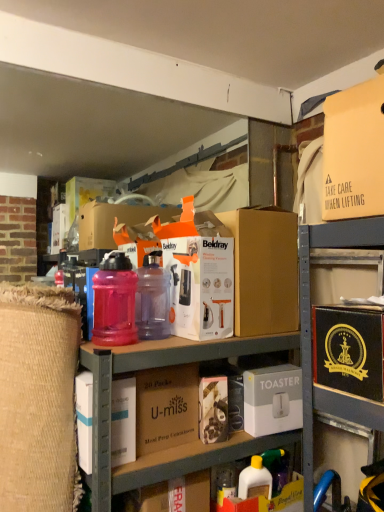
Question: From a real-world perspective, is purple translucent bottle at center, which ranks as the 1th bottle in right-to-left order, beneath white cardboard toaster at center, the 6th box from the top?

Choices:
 (A) yes
 (B) no

Answer: (B)

Question: Is purple translucent bottle at center, which ranks as the 1th bottle in right-to-left order, shorter than white cardboard toaster at center, the 6th box from the top?

Choices:
 (A) no
 (B) yes

Answer: (A)

Question: Is purple translucent bottle at center, which ranks as the 1th bottle in right-to-left order, wider than white cardboard toaster at center, positioned as the 1th box in bottom-to-top order?

Choices:
 (A) no
 (B) yes

Answer: (A)

Question: Is purple translucent bottle at center, which ranks as the 1th bottle in right-to-left order, taller than white cardboard toaster at center, the 6th box from the top?

Choices:
 (A) yes
 (B) no

Answer: (A)

Question: From the image's perspective, does purple translucent bottle at center, which is the second bottle in left-to-right order, appear higher than white cardboard toaster at center, positioned as the 1th box in bottom-to-top order?

Choices:
 (A) yes
 (B) no

Answer: (A)

Question: Is yellow plastic bottle at lower center in front of or behind matte cardboard box at upper right, which is counted as the first box, starting from the top, in the image?

Choices:
 (A) behind
 (B) front

Answer: (A)

Question: Which is correct: yellow plastic bottle at lower center is inside matte cardboard box at upper right, which is counted as the first box, starting from the top, or outside of it?

Choices:
 (A) outside
 (B) inside

Answer: (A)

Question: Does point (244, 476) appear closer or farther from the camera than point (357, 111)?

Choices:
 (A) farther
 (B) closer

Answer: (A)

Question: From the image's perspective, is yellow plastic bottle at lower center located above or below matte cardboard box at upper right, placed as the 6th box when sorted from bottom to top?

Choices:
 (A) below
 (B) above

Answer: (A)

Question: In terms of height, does white cardboard toaster at center, the 6th box from the top, look taller or shorter compared to yellow plastic bottle at lower center?

Choices:
 (A) short
 (B) tall

Answer: (A)

Question: From a real-world perspective, is white cardboard toaster at center, the 6th box from the top, positioned above or below yellow plastic bottle at lower center?

Choices:
 (A) above
 (B) below

Answer: (A)

Question: Relative to yellow plastic bottle at lower center, is white cardboard toaster at center, positioned as the 1th box in bottom-to-top order, in front or behind?

Choices:
 (A) behind
 (B) front

Answer: (A)

Question: In terms of width, does white cardboard toaster at center, positioned as the 1th box in bottom-to-top order, look wider or thinner when compared to yellow plastic bottle at lower center?

Choices:
 (A) thin
 (B) wide

Answer: (B)

Question: Visually, is brown cardboard box at center, which is the fourth box from top to bottom, positioned to the left or to the right of white cardboard box at lower left, positioned as the 5th box in top-to-bottom order?

Choices:
 (A) right
 (B) left

Answer: (A)

Question: In terms of size, does brown cardboard box at center, which is the fourth box from top to bottom, appear bigger or smaller than white cardboard box at lower left, placed as the second box when sorted from bottom to top?

Choices:
 (A) small
 (B) big

Answer: (B)